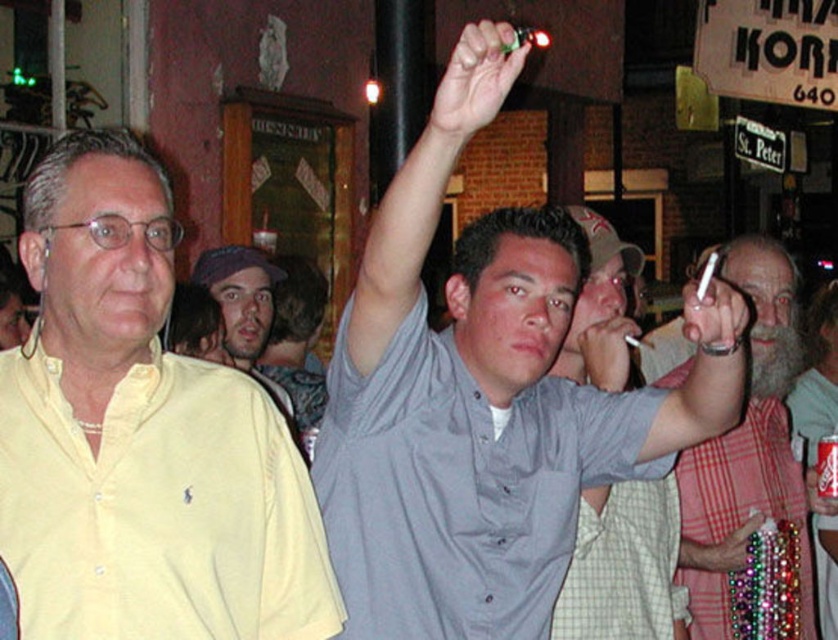
Question: Which point is closer to the camera?

Choices:
 (A) (746, 408)
 (B) (510, 56)

Answer: (B)

Question: Does yellow cotton shirt at left appear under metallic silver can at upper right?

Choices:
 (A) yes
 (B) no

Answer: (B)

Question: In this image, where is gray fabric shirt at upper center located relative to green matte object at upper center?

Choices:
 (A) right
 (B) left

Answer: (A)

Question: Which of these objects is positioned farthest from the matte gray shirt at upper center?

Choices:
 (A) green matte object at upper center
 (B) yellow cotton shirt at left
 (C) gray matte shirt at upper center
 (D) gray matte shirt at center

Answer: (B)

Question: Which object is farther from the camera taking this photo?

Choices:
 (A) matte purple cap at center
 (B) multicolored beads at center

Answer: (A)

Question: Where is red plaid shirt at right located in relation to multicolored beads at center in the image?

Choices:
 (A) left
 (B) right

Answer: (B)